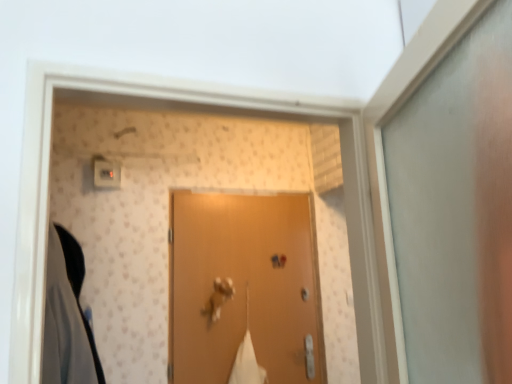
What is the approximate width of matte plastic light switch at upper left?

The width of matte plastic light switch at upper left is 2.87 inches.

Identify the location of matte brown door at center. (244, 286).

From the image's perspective, is dark gray fabric at left located above matte plastic light switch at upper left?

No, from the image's perspective, dark gray fabric at left is not on top of matte plastic light switch at upper left.

Can you confirm if dark gray fabric at left is thinner than matte plastic light switch at upper left?

Incorrect, the width of dark gray fabric at left is not less than that of matte plastic light switch at upper left.

From a real-world perspective, relative to matte plastic light switch at upper left, is dark gray fabric at left vertically above or below?

dark gray fabric at left is situated lower than matte plastic light switch at upper left in the real world.

Is dark gray fabric at left not near matte plastic light switch at upper left?

That's not correct — dark gray fabric at left is a little close to matte plastic light switch at upper left.

Is matte brown door at center directly adjacent to dark gray fabric at left?

matte brown door at center and dark gray fabric at left are not in contact.

Is matte brown door at center spatially inside dark gray fabric at left, or outside of it?

matte brown door at center is located beyond the bounds of dark gray fabric at left.

Which of these two, matte brown door at center or dark gray fabric at left, stands taller?

With more height is matte brown door at center.

Does matte plastic light switch at upper left contain metallic gold door handle at center?

No, metallic gold door handle at center is not surrounded by matte plastic light switch at upper left.

From the image's perspective, who appears lower, matte plastic light switch at upper left or metallic gold door handle at center?

metallic gold door handle at center is shown below in the image.

Does matte plastic light switch at upper left have a larger size compared to metallic gold door handle at center?

Actually, matte plastic light switch at upper left might be smaller than metallic gold door handle at center.

The height and width of the screenshot is (384, 512). I want to click on light switch in front of the metallic gold door handle at center, so click(106, 174).

Looking at this image, is matte plastic light switch at upper left placed right next to matte brown door at center?

There is a gap between matte plastic light switch at upper left and matte brown door at center.

You are a GUI agent. You are given a task and a screenshot of the screen. Output one action in this format:
    pyautogui.click(x=<x>, y=<y>)
    Task: Click on the light switch above the matte brown door at center (from the image's perspective)
    
    Given the screenshot: What is the action you would take?
    pyautogui.click(x=106, y=174)

Who is smaller, matte plastic light switch at upper left or matte brown door at center?

matte plastic light switch at upper left.

Is matte plastic light switch at upper left turned away from matte brown door at center?

No, matte brown door at center is not at the back of matte plastic light switch at upper left.

Would you say dark gray fabric at left is outside matte brown door at center?

Yes, dark gray fabric at left is outside of matte brown door at center.

In the scene shown: Can you confirm if dark gray fabric at left is smaller than matte brown door at center?

Actually, dark gray fabric at left might be larger than matte brown door at center.

What's the angular difference between dark gray fabric at left and matte brown door at center's facing directions?

2.19 degrees.

This screenshot has width=512, height=384. Identify the location of clothing lying on the left of metallic gold door handle at center. (67, 316).

Does point (57, 313) come farther from viewer compared to point (223, 285)?

That is False.

Considering the positions of objects dark gray fabric at left and metallic gold door handle at center in the image provided, who is in front, dark gray fabric at left or metallic gold door handle at center?

dark gray fabric at left is in front.

Is dark gray fabric at left oriented towards metallic gold door handle at center?

No, dark gray fabric at left is not turned towards metallic gold door handle at center.

Does metallic gold door handle at center have a lesser height compared to matte brown door at center?

Correct, metallic gold door handle at center is not as tall as matte brown door at center.

Between metallic gold door handle at center and matte brown door at center, which one is positioned in front?

matte brown door at center.

From the image's perspective, which object appears higher, metallic gold door handle at center or matte brown door at center?

matte brown door at center, from the image's perspective.

Is matte brown door at center located within metallic gold door handle at center?

Definitely not — matte brown door at center is not inside metallic gold door handle at center.

Locate an element on the screen. light switch located above the dark gray fabric at left (from a real-world perspective) is located at coordinates (106, 174).

Identify the location of door below the dark gray fabric at left (from the image's perspective). This screenshot has width=512, height=384. (244, 286).

Which object lies nearer to the anchor point metallic gold door handle at center, matte plastic light switch at upper left or dark gray fabric at left?

dark gray fabric at left is positioned closer to the anchor metallic gold door handle at center.

Looking at the image, which one is located closer to dark gray fabric at left, metallic gold door handle at center or matte brown door at center?

The object closer to dark gray fabric at left is matte brown door at center.

Based on their spatial positions, is metallic gold door handle at center or matte plastic light switch at upper left further from dark gray fabric at left?

metallic gold door handle at center lies further to dark gray fabric at left than the other object.

Considering their positions, is matte plastic light switch at upper left positioned further to dark gray fabric at left than matte brown door at center?

Based on the image, matte brown door at center appears to be further to dark gray fabric at left.

When comparing their distances from dark gray fabric at left, does matte brown door at center or metallic gold door handle at center seem further?

metallic gold door handle at center lies further to dark gray fabric at left than the other object.

When comparing their distances from dark gray fabric at left, does matte brown door at center or matte plastic light switch at upper left seem further?

Based on the image, matte brown door at center appears to be further to dark gray fabric at left.

From the image, which object appears to be nearer to metallic gold door handle at center, dark gray fabric at left or matte plastic light switch at upper left?

dark gray fabric at left is closer to metallic gold door handle at center.

From the image, which object appears to be nearer to metallic gold door handle at center, matte plastic light switch at upper left or matte brown door at center?

The object closer to metallic gold door handle at center is matte brown door at center.

At what (x,y) coordinates should I click in order to perform the action: click on door between dark gray fabric at left and metallic gold door handle at center in the front-back direction. Please return your answer as a coordinate pair (x, y). Looking at the image, I should click on (244, 286).

Locate an element on the screen. The height and width of the screenshot is (384, 512). light switch positioned between dark gray fabric at left and metallic gold door handle at center from near to far is located at coordinates (106, 174).

In order to click on door handle located between matte plastic light switch at upper left and matte brown door at center in the left-right direction in this screenshot , I will do `click(218, 298)`.

This screenshot has height=384, width=512. What are the coordinates of `door located between dark gray fabric at left and matte plastic light switch at upper left in the depth direction` in the screenshot? It's located at (244, 286).